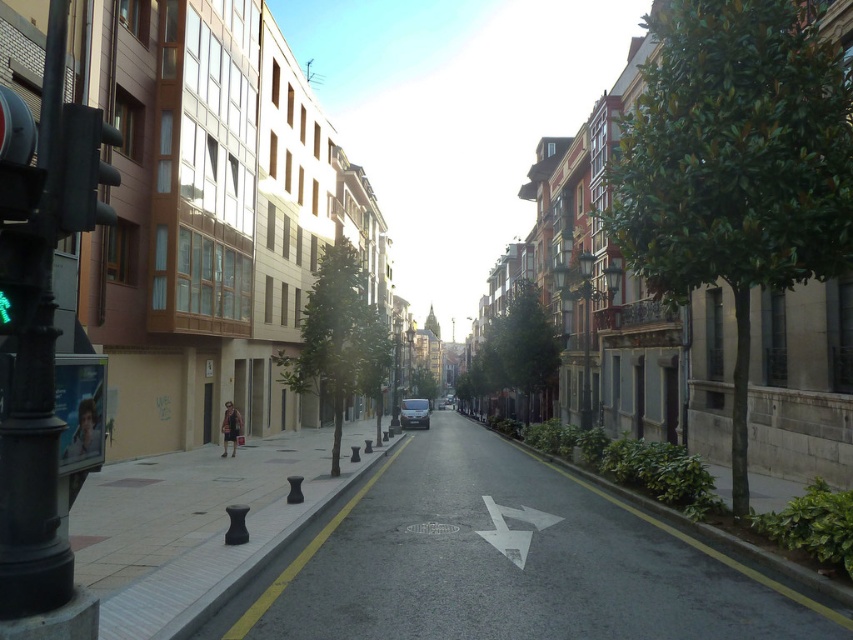
You are driving a delivery van that is 2.5 meters wide. You need to turn right at the intersection ahead. There is a black metal pole at left and black rubber bollards at center in your path. Can you safely navigate around them without hitting either object?

The black metal pole at left is to the left of the black rubber bollards at center. Since the bollards are at the center, you can safely turn right by staying to the right side of the road, avoiding both the pole and the bollards. The van is 2.5 meters wide, which should fit within the available space if the right lane is appropriately sized.

You are a delivery driver who needs to turn right at the intersection ahead. You see a matte black traffic light at left and a white paper arrow at center. Which object is taller and could potentially block your view of oncoming traffic when making the turn?

The matte black traffic light at left is taller than the white paper arrow at center, so it could potentially block your view of oncoming traffic when making the turn.